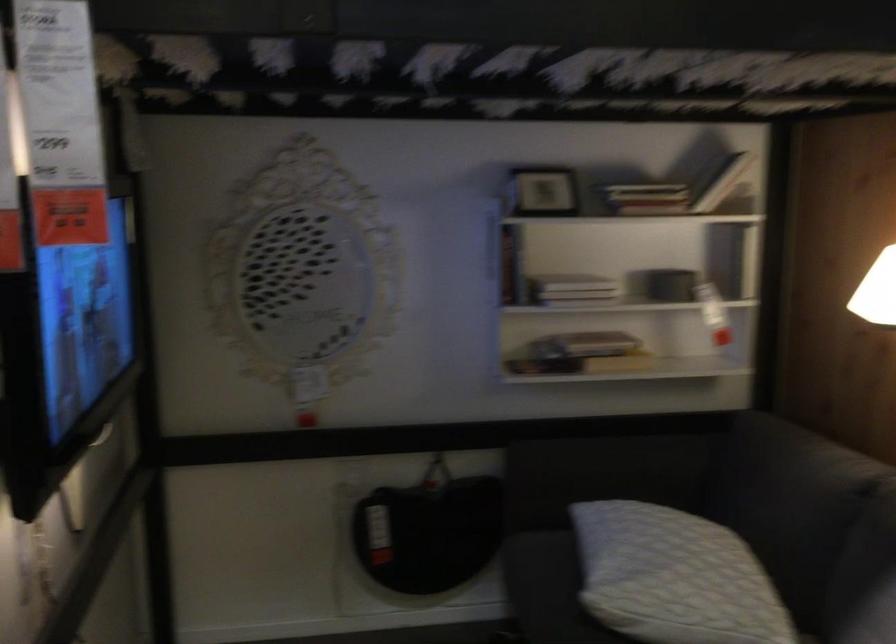
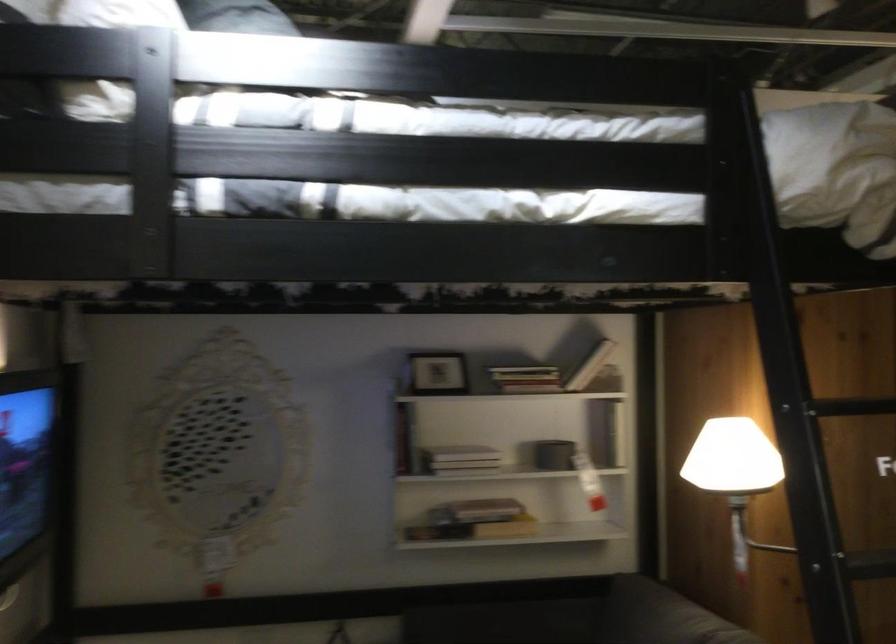
Question: I am providing you with two images of the same scene from different viewpoints. Please identify which objects are invisible in image2.

Choices:
 (A) white lamp head
 (B) dark cylindrical cup
 (C) black ladder rung
 (D) none of these

Answer: (D)